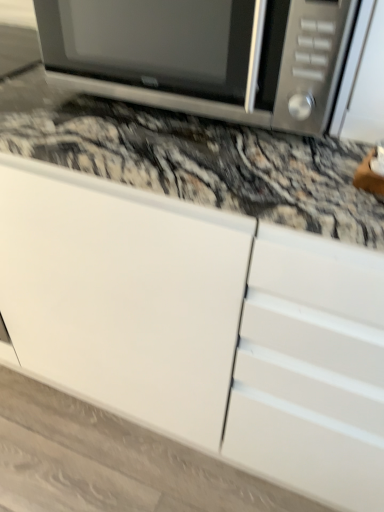
Question: From the image's perspective, relative to white matte cabinet at upper center, is satin silver microwave at upper center above or below?

Choices:
 (A) below
 (B) above

Answer: (B)

Question: Considering the positions of satin silver microwave at upper center and white matte cabinet at upper center in the image, is satin silver microwave at upper center wider or thinner than white matte cabinet at upper center?

Choices:
 (A) wide
 (B) thin

Answer: (B)

Question: Considering the relative positions of satin silver microwave at upper center and white matte cabinet at upper center in the image provided, is satin silver microwave at upper center to the left or to the right of white matte cabinet at upper center?

Choices:
 (A) left
 (B) right

Answer: (B)

Question: Does point (6, 252) appear closer or farther from the camera than point (281, 68)?

Choices:
 (A) closer
 (B) farther

Answer: (B)

Question: From the image's perspective, is white matte cabinet at upper center above or below satin silver microwave at upper center?

Choices:
 (A) below
 (B) above

Answer: (A)

Question: From a real-world perspective, relative to satin silver microwave at upper center, is white matte cabinet at upper center vertically above or below?

Choices:
 (A) below
 (B) above

Answer: (A)

Question: Choose the correct answer: Is white matte cabinet at upper center inside satin silver microwave at upper center or outside it?

Choices:
 (A) outside
 (B) inside

Answer: (A)